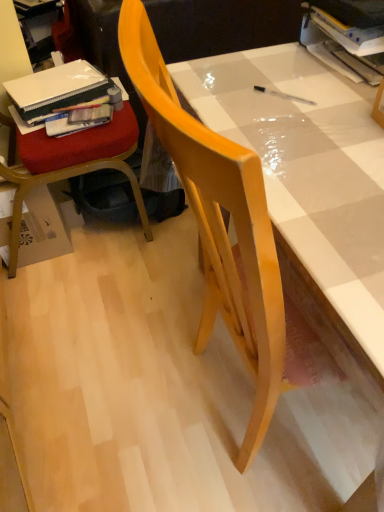
Question: Is wooden chair at left, which appears as the 2th chair when viewed from the right, facing towards matte white table at center?

Choices:
 (A) yes
 (B) no

Answer: (B)

Question: Would you say wooden chair at left, which appears as the 2th chair when viewed from the right, contains matte white table at center?

Choices:
 (A) no
 (B) yes

Answer: (A)

Question: Is wooden chair at left, the first chair viewed from the left, positioned behind matte white table at center?

Choices:
 (A) yes
 (B) no

Answer: (A)

Question: Would you say wooden chair at left, the first chair viewed from the left, is outside matte white table at center?

Choices:
 (A) no
 (B) yes

Answer: (B)

Question: Can you confirm if wooden chair at left, the first chair viewed from the left, is taller than matte white table at center?

Choices:
 (A) no
 (B) yes

Answer: (B)

Question: Considering the positions of matte plastic book at left, which ranks as the 2th book in right-to-left order, and matte white table at center in the image, is matte plastic book at left, which ranks as the 2th book in right-to-left order, taller or shorter than matte white table at center?

Choices:
 (A) short
 (B) tall

Answer: (A)

Question: In the image, is matte plastic book at left, positioned as the second book in back-to-front order, on the left side or the right side of matte white table at center?

Choices:
 (A) right
 (B) left

Answer: (B)

Question: In terms of size, does matte plastic book at left, positioned as the second book in back-to-front order, appear bigger or smaller than matte white table at center?

Choices:
 (A) big
 (B) small

Answer: (B)

Question: From the image's perspective, relative to matte white table at center, is matte plastic book at left, positioned as the second book in back-to-front order, above or below?

Choices:
 (A) above
 (B) below

Answer: (A)

Question: From a real-world perspective, is matte wood chair at center, positioned as the second chair in left-to-right order, physically located above or below wooden chair at left, which appears as the 2th chair when viewed from the right?

Choices:
 (A) above
 (B) below

Answer: (A)

Question: In terms of height, does matte wood chair at center, the first chair viewed from the right, look taller or shorter compared to wooden chair at left, the first chair viewed from the left?

Choices:
 (A) tall
 (B) short

Answer: (A)

Question: Would you say matte wood chair at center, positioned as the second chair in left-to-right order, is inside or outside wooden chair at left, which appears as the 2th chair when viewed from the right?

Choices:
 (A) inside
 (B) outside

Answer: (B)

Question: In the image, is matte wood chair at center, positioned as the second chair in left-to-right order, on the left side or the right side of wooden chair at left, the first chair viewed from the left?

Choices:
 (A) right
 (B) left

Answer: (A)

Question: Considering the positions of matte white table at center and wooden chair at left, which appears as the 2th chair when viewed from the right, in the image, is matte white table at center bigger or smaller than wooden chair at left, which appears as the 2th chair when viewed from the right,?

Choices:
 (A) small
 (B) big

Answer: (B)

Question: Considering the relative positions of matte white table at center and wooden chair at left, which appears as the 2th chair when viewed from the right, in the image provided, is matte white table at center to the left or to the right of wooden chair at left, which appears as the 2th chair when viewed from the right,?

Choices:
 (A) left
 (B) right

Answer: (B)